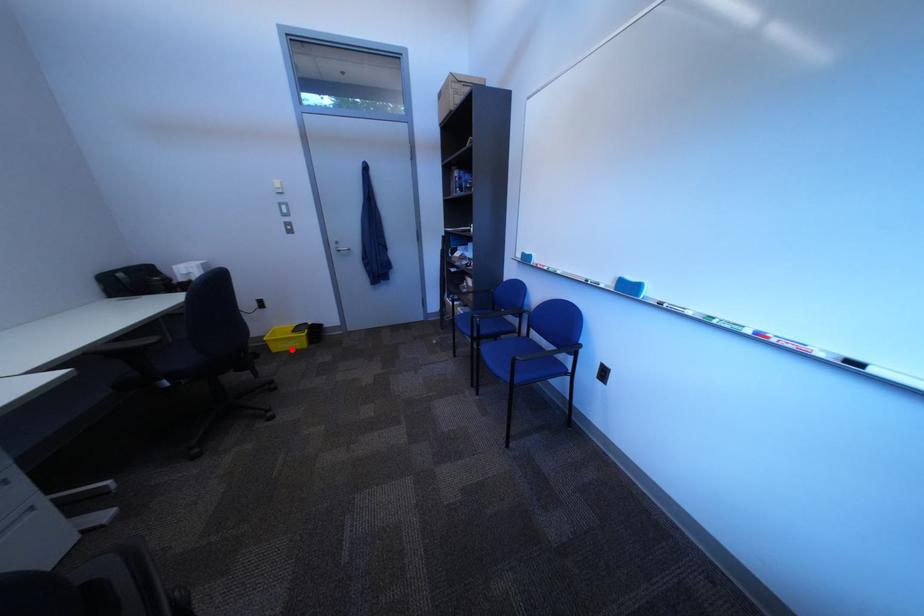
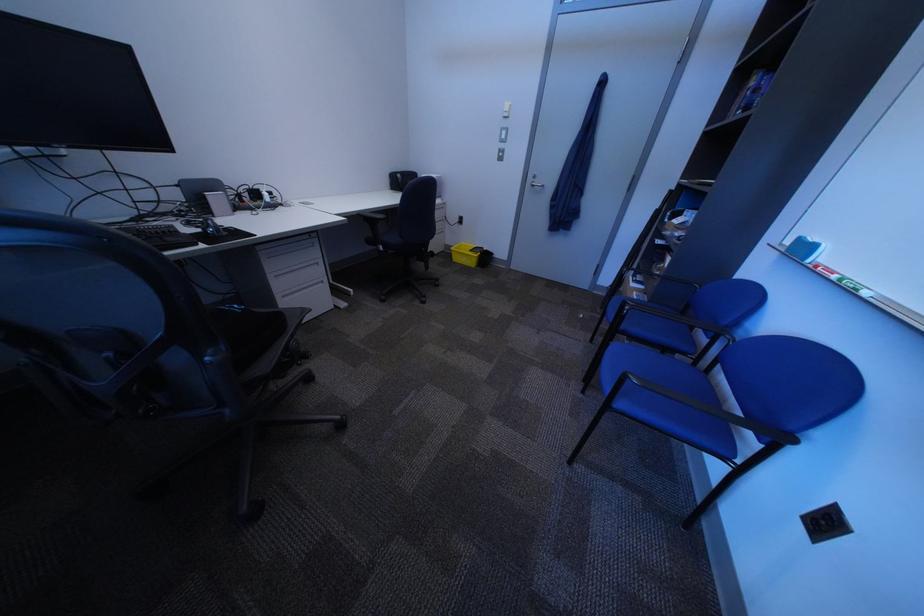
Find the pixel in the second image that matches the highlighted location in the first image.

(470, 261)